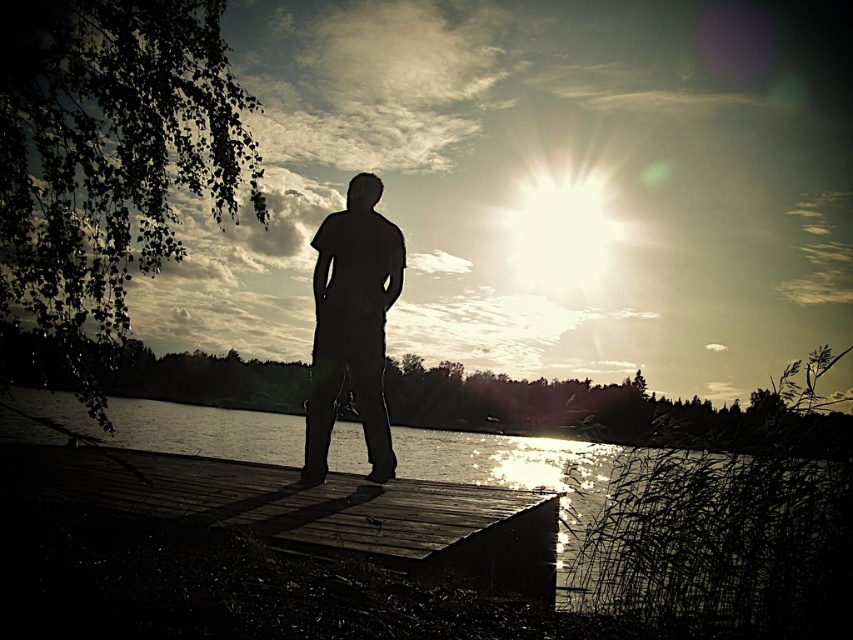
Question: Estimate the real-world distances between objects in this image. Which object is farther from the silvery water at dock center?

Choices:
 (A) dark wood dock at center
 (B) silhouette figure at center

Answer: (A)

Question: Does dark wood dock at center have a smaller size compared to silhouette figure at center?

Choices:
 (A) no
 (B) yes

Answer: (B)

Question: Which object is farther from the camera taking this photo?

Choices:
 (A) silhouette figure at center
 (B) silvery water at dock center
 (C) dark wood dock at center

Answer: (C)

Question: Can you confirm if dark wood dock at center is smaller than silvery water at dock center?

Choices:
 (A) no
 (B) yes

Answer: (B)

Question: Can you confirm if dark wood dock at center is positioned to the left of silhouette figure at center?

Choices:
 (A) yes
 (B) no

Answer: (A)

Question: Based on their relative distances, which object is nearer to the silhouette figure at center?

Choices:
 (A) dark wood dock at center
 (B) silvery water at dock center

Answer: (A)